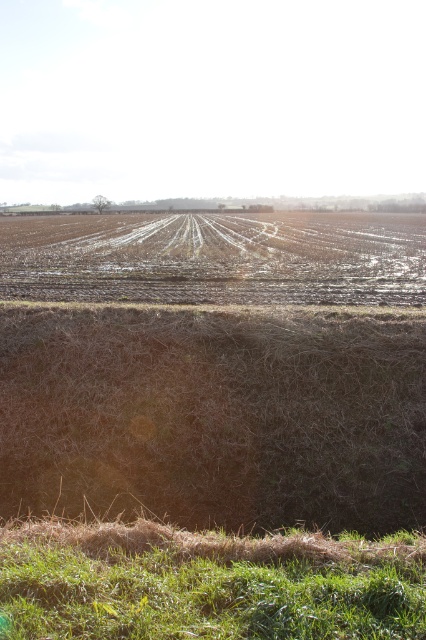
Question: Is brown dry hay at lower center to the left of green grassy hill at lower center from the viewer's perspective?

Choices:
 (A) no
 (B) yes

Answer: (B)

Question: Which object appears farthest from the camera in this image?

Choices:
 (A) green grassy hill at lower center
 (B) brown dry hay at lower center

Answer: (B)

Question: From the image, what is the correct spatial relationship of brown dry hay at lower center in relation to green grassy hill at lower center?

Choices:
 (A) left
 (B) right

Answer: (A)

Question: Which object is closer to the camera taking this photo?

Choices:
 (A) brown dry hay at lower center
 (B) green grassy hill at lower center

Answer: (B)

Question: Among these objects, which one is farthest from the camera?

Choices:
 (A) brown dry hay at lower center
 (B) green grassy hill at lower center

Answer: (A)

Question: Is brown dry hay at lower center thinner than green grassy hill at lower center?

Choices:
 (A) yes
 (B) no

Answer: (B)